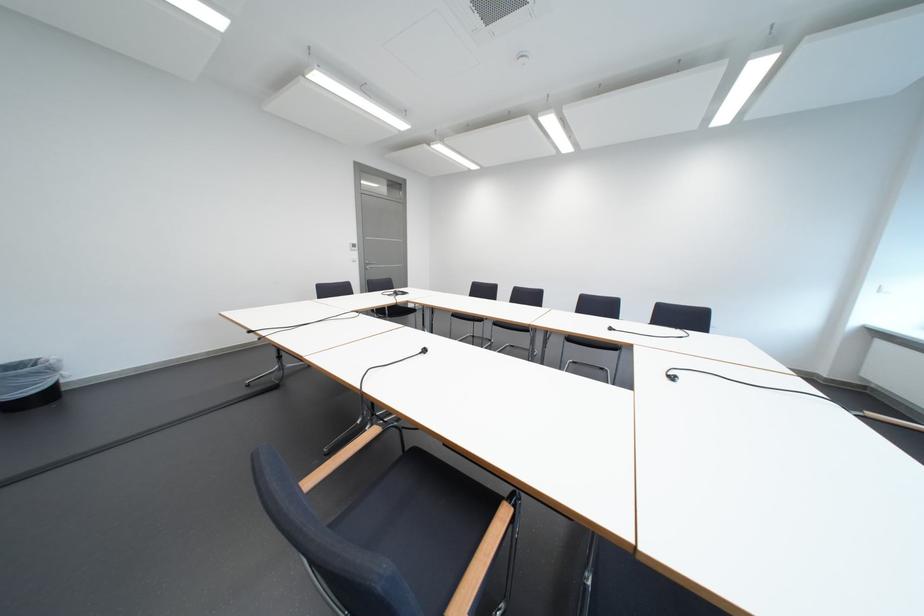
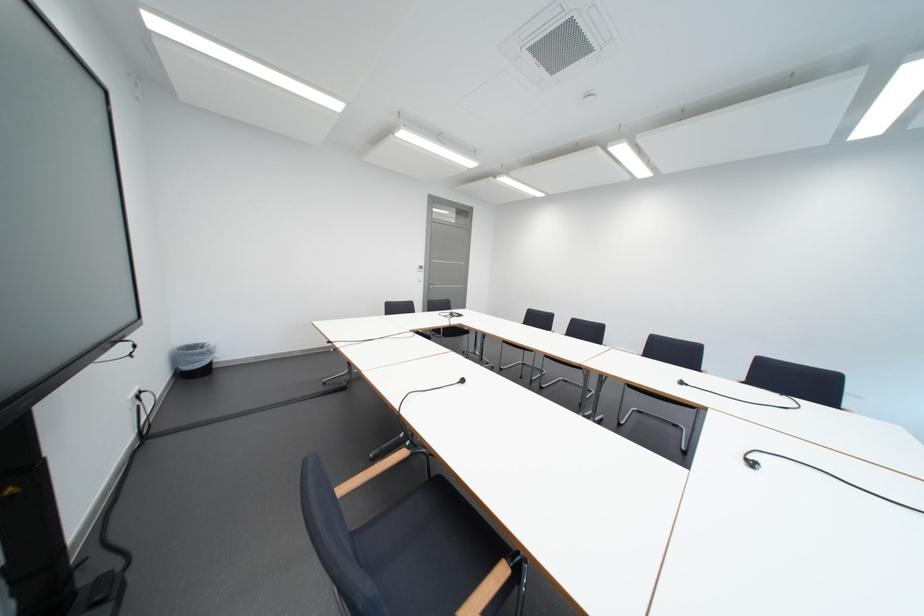
Question: The camera is either moving clockwise (left) or counter-clockwise (right) around the object. The first image is from the beginning of the video and the second image is from the end. Is the camera moving left or right when shooting the video?

Choices:
 (A) Left
 (B) Right

Answer: (B)